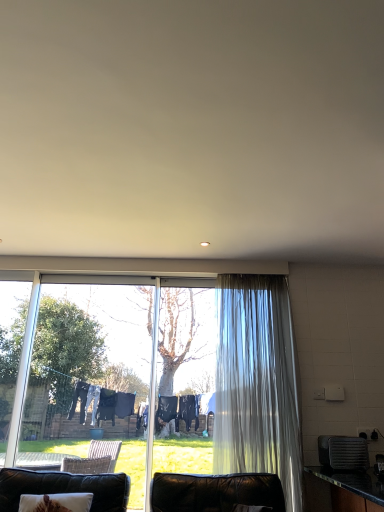
You are a GUI agent. You are given a task and a screenshot of the screen. Output one action in this format:
    pyautogui.click(x=<x>, y=<y>)
    Task: Click on the translucent fabric curtain at right
    This screenshot has width=384, height=512.
    Given the screenshot: What is the action you would take?
    pyautogui.click(x=257, y=383)

Where is `leather couch at lower left`? The width and height of the screenshot is (384, 512). leather couch at lower left is located at coordinates (64, 488).

Does black plastic toaster at right have a greater width compared to leather couch at lower left?

No.

Is black plastic toaster at right looking in the opposite direction of leather couch at lower left?

Yes, leather couch at lower left is at the back of black plastic toaster at right.

Image resolution: width=384 pixels, height=512 pixels. I want to click on furniture that appears on the left of translucent fabric curtain at right, so click(64, 488).

How distant is leather couch at lower left from translucent fabric curtain at right?

They are 1.15 meters apart.

Who is shorter, leather couch at lower left or translucent fabric curtain at right?

leather couch at lower left is shorter.

Considering the points (250, 409) and (324, 444), which point is in front, point (250, 409) or point (324, 444)?

The point (324, 444) is in front.

Is translucent fabric curtain at right behind black plastic toaster at right?

Yes, translucent fabric curtain at right is further from the camera.

From a real-world perspective, which object stands above the other?

translucent fabric curtain at right.

Locate an element on the screen. The image size is (384, 512). appliance in front of the translucent fabric curtain at right is located at coordinates (343, 453).

Is translucent fabric curtain at right completely or partially outside of leather couch at lower left?

Indeed, translucent fabric curtain at right is completely outside leather couch at lower left.

Considering the sizes of translucent fabric curtain at right and leather couch at lower left in the image, is translucent fabric curtain at right wider or thinner than leather couch at lower left?

translucent fabric curtain at right is thinner than leather couch at lower left.

Locate an element on the screen. The image size is (384, 512). curtain that is above the leather couch at lower left (from the image's perspective) is located at coordinates (257, 383).

Can you tell me how much black plastic toaster at right and translucent fabric curtain at right differ in facing direction?

There is a 82.9-degree angle between the facing directions of black plastic toaster at right and translucent fabric curtain at right.

Which is farther, (x=345, y=462) or (x=257, y=282)?

Positioned behind is point (x=257, y=282).

Which of these two, black plastic toaster at right or translucent fabric curtain at right, is thinner?

translucent fabric curtain at right.

Is translucent fabric curtain at right a part of black plastic toaster at right?

No, translucent fabric curtain at right is not a part of black plastic toaster at right.

Does point (102, 474) come farther from viewer compared to point (327, 461)?

Yes, point (102, 474) is behind point (327, 461).

From a real-world perspective, is leather couch at lower left positioned over black plastic toaster at right based on gravity?

No, from a real-world perspective, leather couch at lower left is not above black plastic toaster at right.

Which of these two, leather couch at lower left or black plastic toaster at right, is wider?

With larger width is leather couch at lower left.

Is black plastic toaster at right at the back of leather couch at lower left?

That's not correct — leather couch at lower left is not looking away from black plastic toaster at right.

The width and height of the screenshot is (384, 512). In order to click on furniture in front of the black plastic toaster at right in this screenshot , I will do `click(64, 488)`.

This screenshot has height=512, width=384. I want to click on curtain on the right of leather couch at lower left, so click(x=257, y=383).

From the image, which object appears to be farther from translucent fabric curtain at right, black plastic toaster at right or leather couch at lower left?

leather couch at lower left lies further to translucent fabric curtain at right than the other object.

From the image, which object appears to be farther from translucent fabric curtain at right, leather couch at lower left or black plastic toaster at right?

leather couch at lower left is further to translucent fabric curtain at right.

When comparing their distances from black plastic toaster at right, does translucent fabric curtain at right or leather couch at lower left seem closer?

The object closer to black plastic toaster at right is translucent fabric curtain at right.

Looking at the image, which one is located closer to leather couch at lower left, black plastic toaster at right or translucent fabric curtain at right?

The object closer to leather couch at lower left is translucent fabric curtain at right.

Estimate the real-world distances between objects in this image. Which object is further from leather couch at lower left, translucent fabric curtain at right or black plastic toaster at right?

black plastic toaster at right lies further to leather couch at lower left than the other object.

Considering their positions, is leather couch at lower left positioned closer to black plastic toaster at right than translucent fabric curtain at right?

translucent fabric curtain at right is closer to black plastic toaster at right.

The image size is (384, 512). I want to click on curtain between leather couch at lower left and black plastic toaster at right from left to right, so click(257, 383).